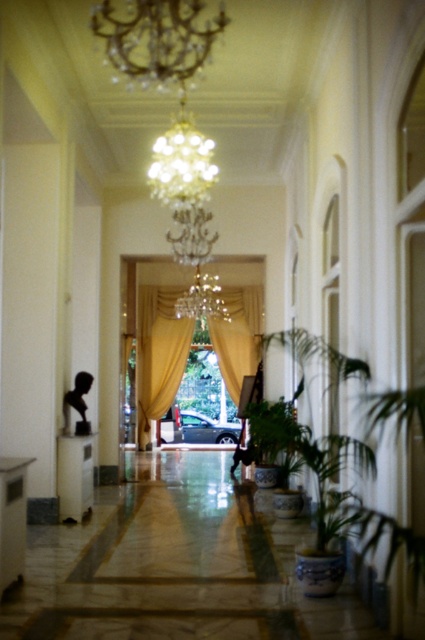
Question: Which point appears closest to the camera in this image?

Choices:
 (A) (155, 365)
 (B) (153, 51)
 (C) (260, 285)

Answer: (B)

Question: Which of the following is the farthest from the observer?

Choices:
 (A) crystal glass chandelier at upper center
 (B) crystal glass chandelier at center
 (C) silky yellow curtain at center
 (D) silky beige curtain at center

Answer: (C)

Question: Does silky yellow curtain at center have a larger size compared to silky beige curtain at center?

Choices:
 (A) yes
 (B) no

Answer: (A)

Question: Is the position of silky yellow curtain at center less distant than that of crystal glass chandelier at center?

Choices:
 (A) yes
 (B) no

Answer: (B)

Question: Is silky yellow curtain at center bigger than silky beige curtain at center?

Choices:
 (A) no
 (B) yes

Answer: (B)

Question: Which object is the closest to the silky yellow curtain at center?

Choices:
 (A) crystal glass chandelier at upper center
 (B) silky beige curtain at center
 (C) crystal glass chandelier at center

Answer: (C)